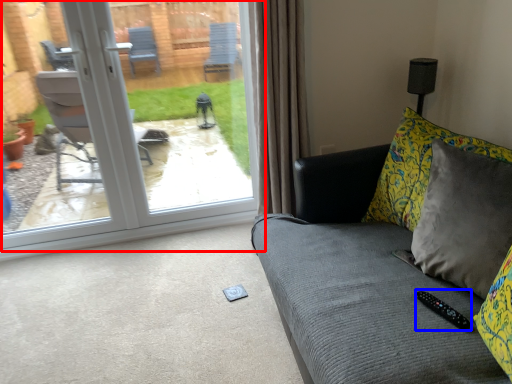
Question: Which of the following is the closest to the observer, door (highlighted by a red box) or remote (highlighted by a blue box)?

Choices:
 (A) door
 (B) remote

Answer: (B)